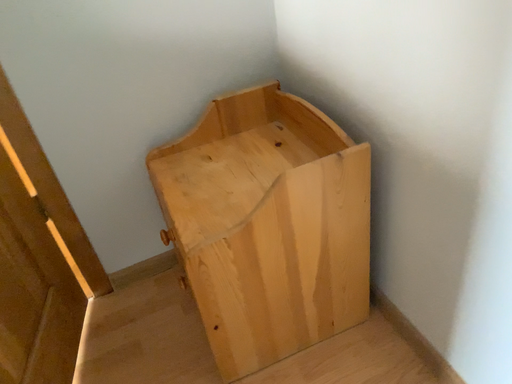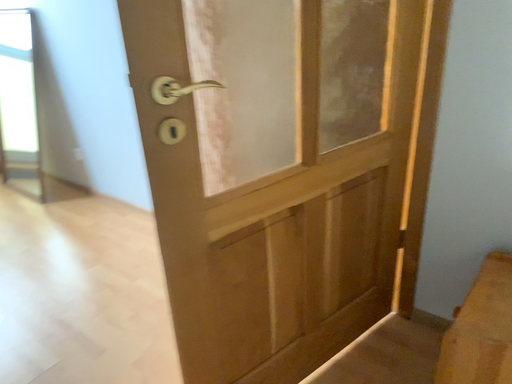
Question: How did the camera likely rotate when shooting the video?

Choices:
 (A) rotated left
 (B) rotated right

Answer: (A)